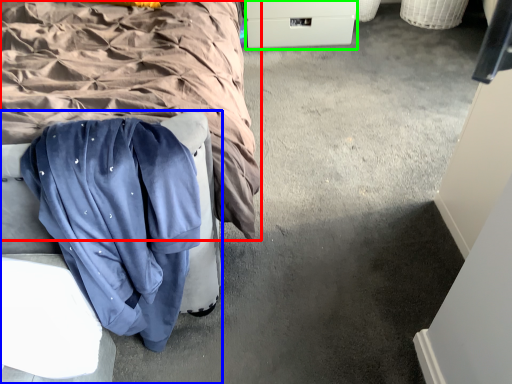
Question: Which object is the farthest from bed (highlighted by a red box)? Choose among these: furniture (highlighted by a blue box) or drawer (highlighted by a green box).

Choices:
 (A) furniture
 (B) drawer

Answer: (B)